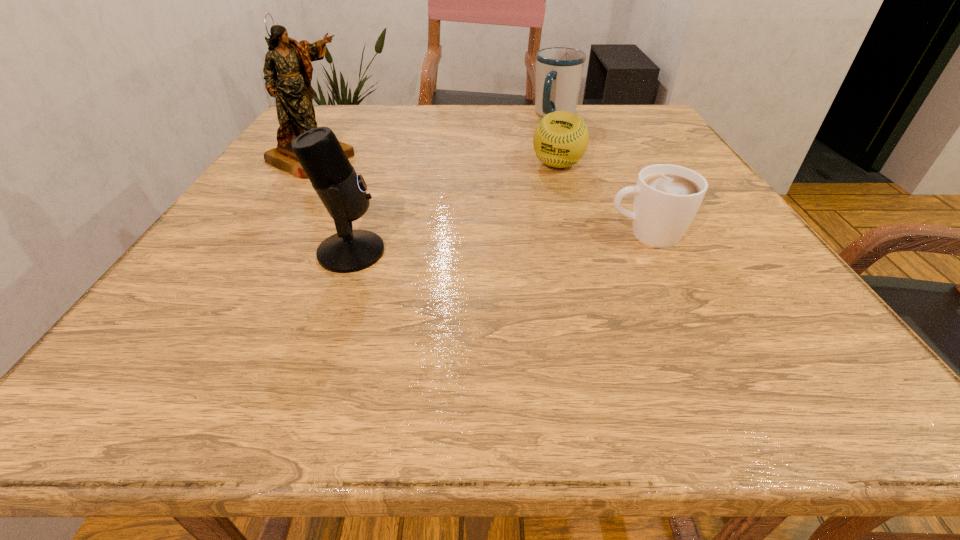
At what (x,y) coordinates should I click in order to perform the action: click on vacant space located on the handle side of the farthest object. Please return your answer as a coordinate pair (x, y). The height and width of the screenshot is (540, 960). Looking at the image, I should click on (529, 171).

Find the location of `figurine that is at the far edge`. figurine that is at the far edge is located at coordinates (291, 87).

Where is `mug that is at the far edge`? The height and width of the screenshot is (540, 960). mug that is at the far edge is located at coordinates (559, 70).

This screenshot has width=960, height=540. I want to click on object at the left edge, so click(x=291, y=87).

Where is `object that is positioned at the right edge`? The image size is (960, 540). object that is positioned at the right edge is located at coordinates (667, 197).

Image resolution: width=960 pixels, height=540 pixels. I want to click on object situated at the far left corner, so click(291, 87).

Identify the location of free space at the far edge. The width and height of the screenshot is (960, 540). (372, 111).

The height and width of the screenshot is (540, 960). Find the location of `vacant region at the near edge`. vacant region at the near edge is located at coordinates (656, 301).

Identify the location of free space at the left edge. This screenshot has width=960, height=540. (292, 188).

The image size is (960, 540). In the image, there is a desktop. What are the coordinates of `vacant space at the right edge` in the screenshot? It's located at 614,144.